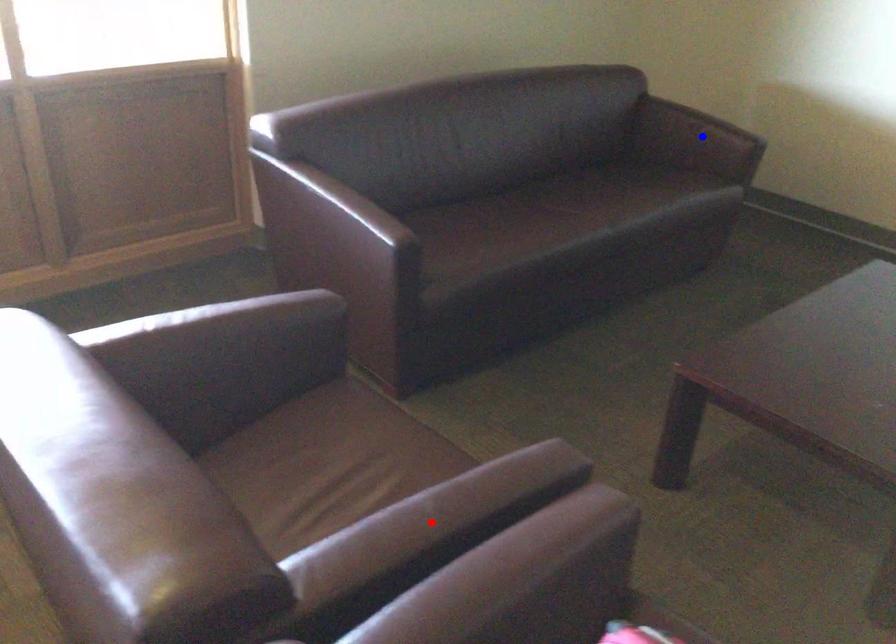
Question: In the image, two points are highlighted. Which point is nearer to the camera? Reply with the corresponding letter.

Choices:
 (A) blue point
 (B) red point

Answer: (B)